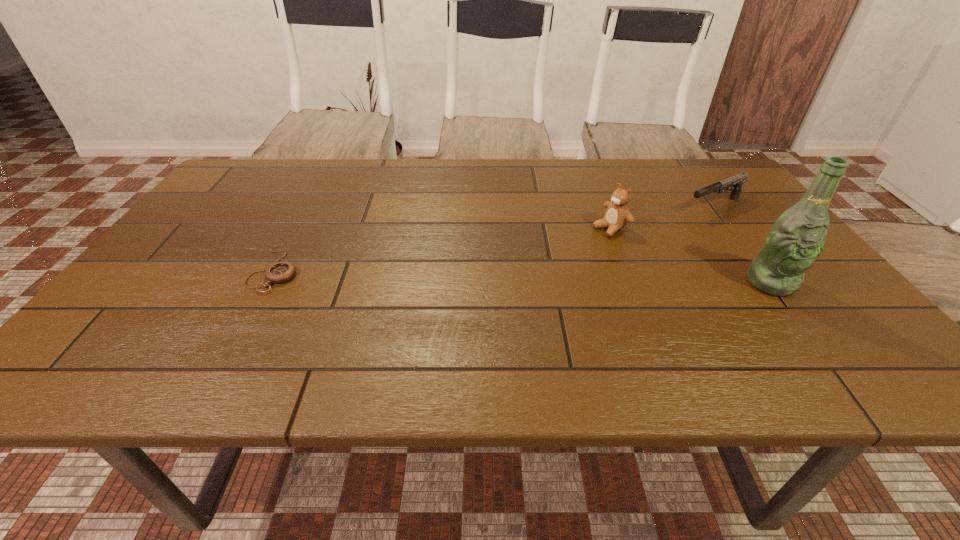
Where is `free space on the desktop that is between the shortest object and the beer bottle and is positioned on the front-facing side of the second tallest object`? This screenshot has width=960, height=540. free space on the desktop that is between the shortest object and the beer bottle and is positioned on the front-facing side of the second tallest object is located at coordinates [506, 276].

Identify the location of vacant space on the desktop that is between the pocket watch and the beer bottle and is positioned at the muzzle end of the third tallest object. (546, 278).